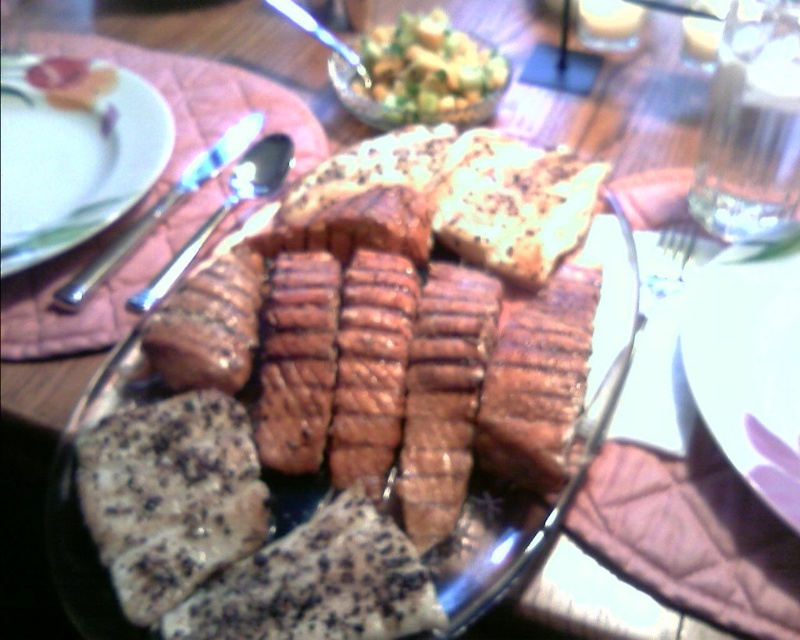
Question: Which of the following is the farthest from the observer?

Choices:
 (A) white glossy plate at center
 (B) satin silver knife at upper left
 (C) white glossy plate at upper left
 (D) brushed metal spoon at upper center

Answer: (D)

Question: Which point is closer to the camera?

Choices:
 (A) green leafy salad at center
 (B) brushed metal spoon at upper center

Answer: (A)

Question: Can you confirm if brown glazed meat at center is thinner than satin silver knife at upper left?

Choices:
 (A) no
 (B) yes

Answer: (A)

Question: Does satin silver knife at upper left come behind brushed metal spoon at upper center?

Choices:
 (A) yes
 (B) no

Answer: (B)

Question: Does brown glazed meat at center appear under green leafy salad at center?

Choices:
 (A) yes
 (B) no

Answer: (A)

Question: Which point is closer to the camera?

Choices:
 (A) satin silver knife at upper left
 (B) brown glazed meat at center
 (C) white glossy plate at center

Answer: (B)